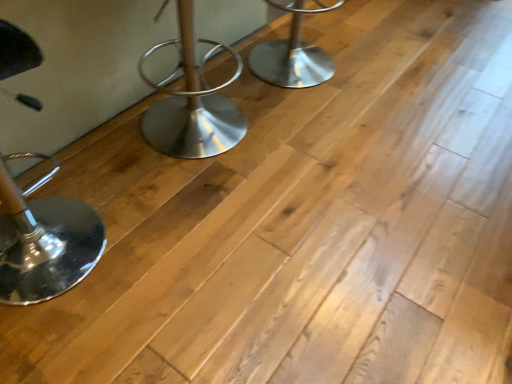
Question: From the image's perspective, is polished chrome stool at left, marked as the first furniture in a bottom-to-top arrangement, positioned above or below polished metal stool at center, which ranks as the 2th furniture in front-to-back order?

Choices:
 (A) below
 (B) above

Answer: (A)

Question: Is polished chrome stool at left, the second furniture positioned from the top, to the left or to the right of polished metal stool at center, marked as the 2th furniture in a bottom-to-top arrangement, in the image?

Choices:
 (A) right
 (B) left

Answer: (B)

Question: Is polished chrome stool at left, the second furniture positioned from the top, wider or thinner than polished metal stool at center, which ranks as the 2th furniture in front-to-back order?

Choices:
 (A) wide
 (B) thin

Answer: (B)

Question: In the image, is polished metal stool at center, which appears as the 1th furniture when viewed from the right, positioned in front of or behind polished chrome stool at left, marked as the first furniture in a bottom-to-top arrangement?

Choices:
 (A) front
 (B) behind

Answer: (B)

Question: In terms of width, does polished metal stool at center, which appears as the 1th furniture when viewed from the right, look wider or thinner when compared to polished chrome stool at left, which is the second furniture in back-to-front order?

Choices:
 (A) thin
 (B) wide

Answer: (B)

Question: Based on their sizes in the image, would you say polished metal stool at center, the second furniture positioned from the left, is bigger or smaller than polished chrome stool at left, which is the 2th furniture in right-to-left order?

Choices:
 (A) small
 (B) big

Answer: (A)

Question: From a real-world perspective, relative to polished chrome stool at left, positioned as the 1th furniture in left-to-right order, is polished metal stool at center, the second furniture positioned from the left, vertically above or below?

Choices:
 (A) above
 (B) below

Answer: (B)